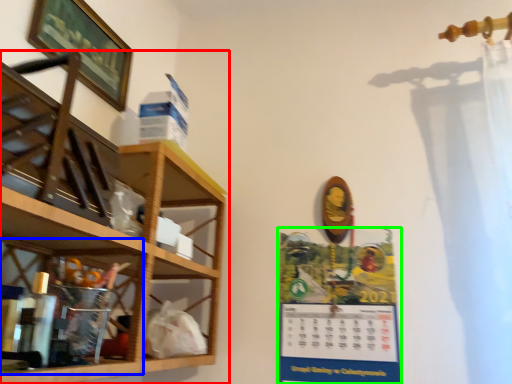
Question: Which is nearer to the shelf (highlighted by a red box)? cabinet (highlighted by a blue box) or poster page (highlighted by a green box).

Choices:
 (A) cabinet
 (B) poster page

Answer: (A)